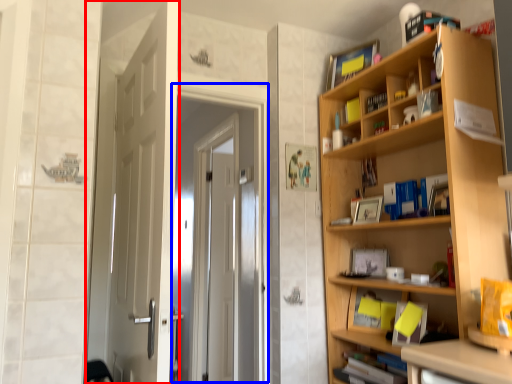
Question: Among these objects, which one is farthest to the camera, door (highlighted by a red box) or screen door (highlighted by a blue box)?

Choices:
 (A) door
 (B) screen door

Answer: (B)